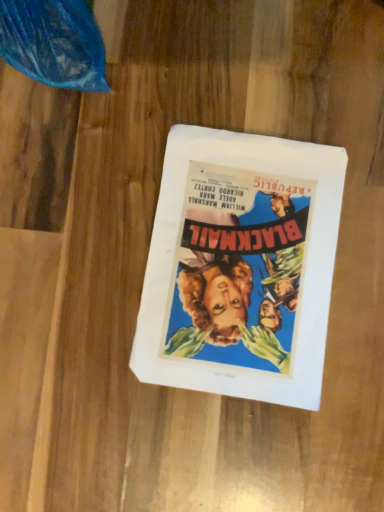
Locate an element on the screen. matte paper book at center is located at coordinates (241, 266).

The width and height of the screenshot is (384, 512). What do you see at coordinates (241, 266) in the screenshot?
I see `matte paper book at center` at bounding box center [241, 266].

This screenshot has width=384, height=512. I want to click on matte paper book at center, so click(241, 266).